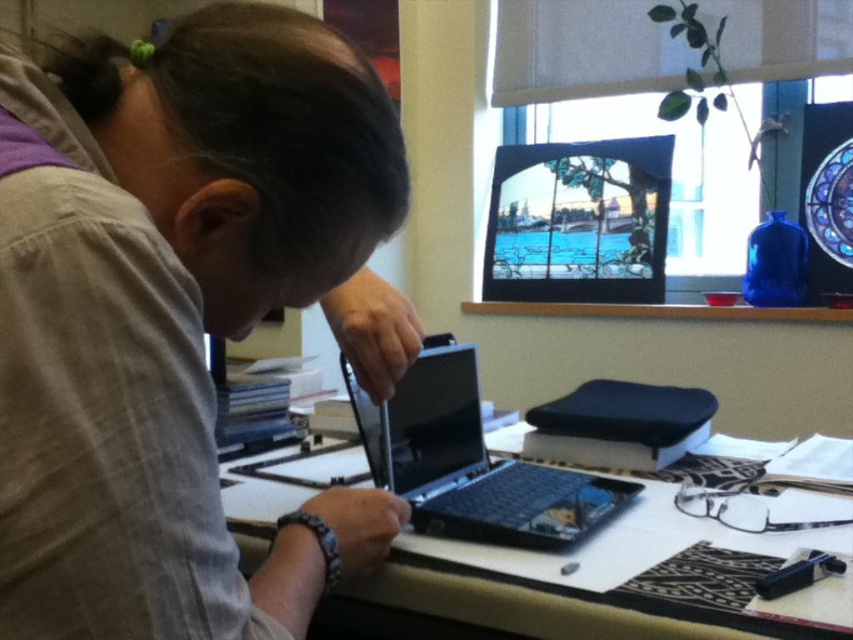
Question: Which point appears closest to the camera in this image?

Choices:
 (A) (573, 480)
 (B) (316, 557)
 (C) (639, 228)
 (D) (782, 556)

Answer: (B)

Question: Which point is farther to the camera?

Choices:
 (A) smooth wooden table at center
 (B) matte glass computer screen at upper center
 (C) matte gray shirt at center
 (D) black plastic laptop at center

Answer: (B)

Question: Can you confirm if black plastic laptop at center is wider than smooth wooden table at center?

Choices:
 (A) yes
 (B) no

Answer: (B)

Question: Which point is farther to the camera?

Choices:
 (A) matte gray shirt at center
 (B) matte glass computer screen at upper center
 (C) black plastic laptop at center

Answer: (B)

Question: Is matte gray shirt at center wider than smooth wooden table at center?

Choices:
 (A) no
 (B) yes

Answer: (A)

Question: Can you confirm if matte glass computer screen at upper center is bigger than smooth wooden table at center?

Choices:
 (A) yes
 (B) no

Answer: (A)